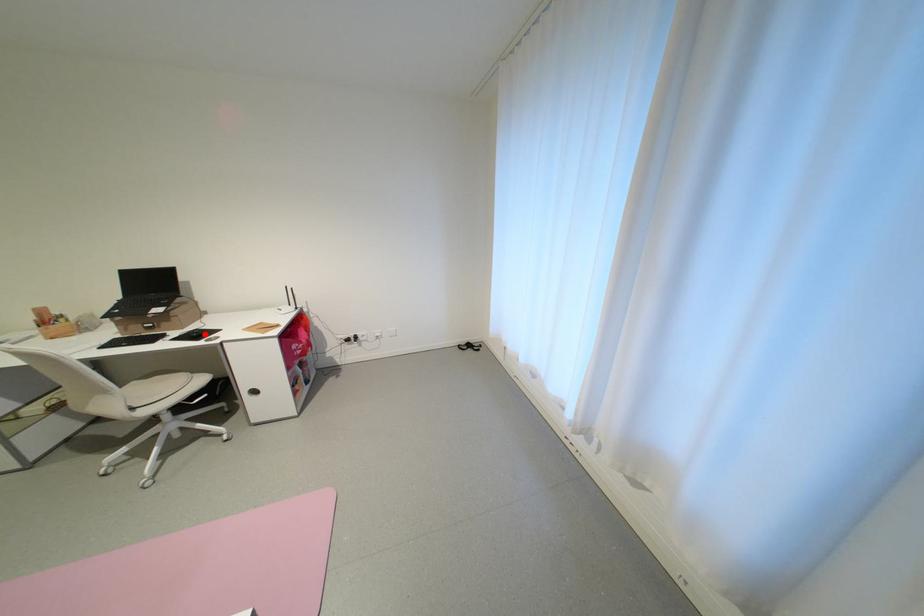
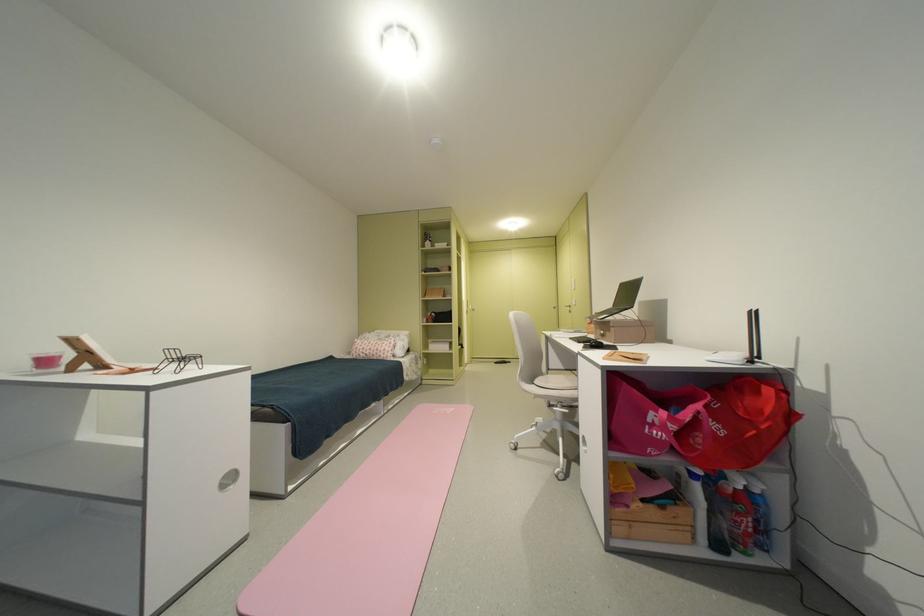
In the second image, find the point that corresponds to the highlighted location in the first image.

(602, 342)